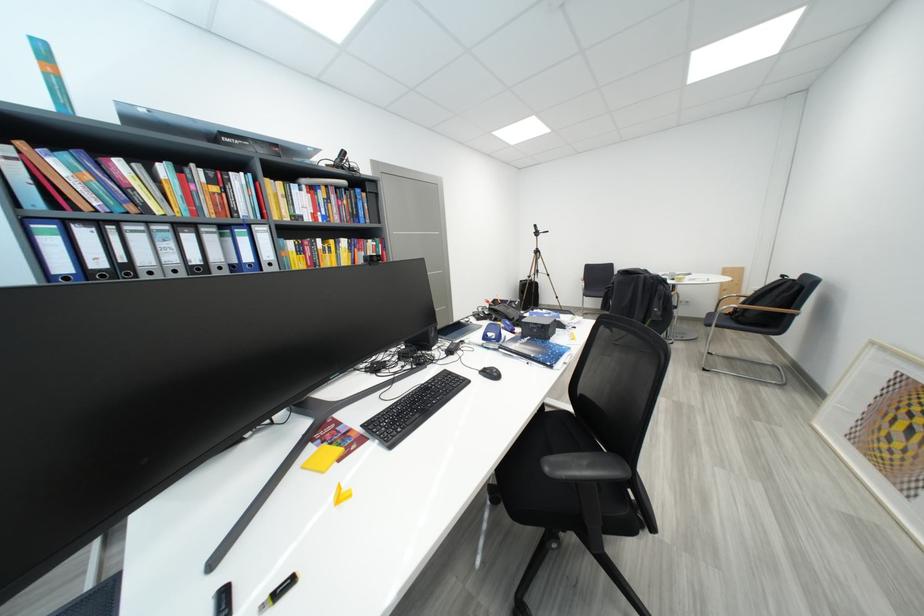
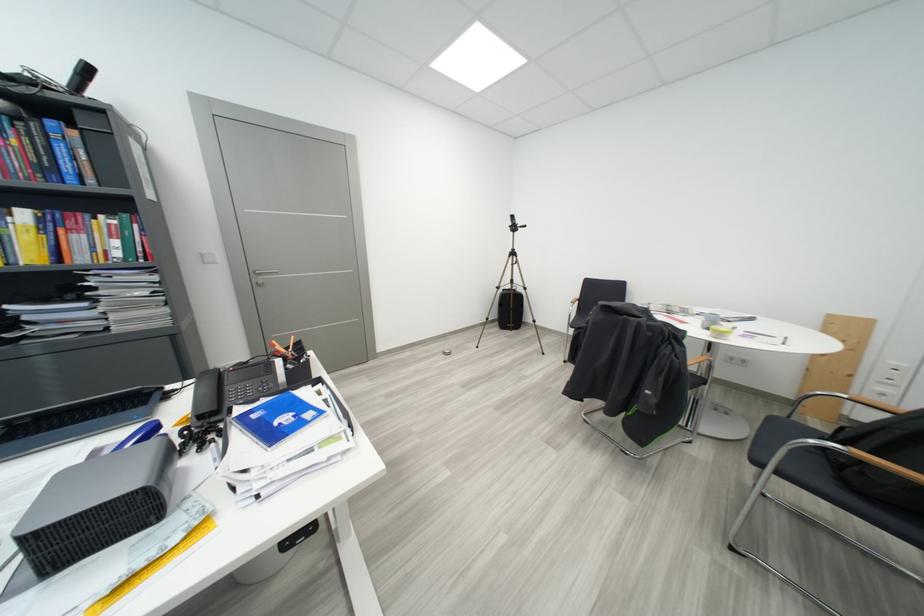
The point at (353, 244) is marked in the first image. Where is the corresponding point in the second image?

(32, 216)